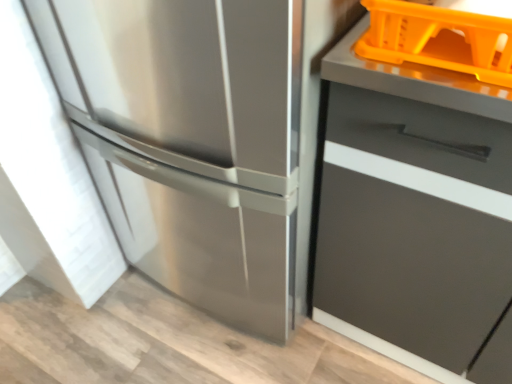
This screenshot has height=384, width=512. What do you see at coordinates (201, 138) in the screenshot?
I see `stainless steel refrigerator at left` at bounding box center [201, 138].

What are the coordinates of `stainless steel refrigerator at left` in the screenshot? It's located at (201, 138).

Measure the distance between point [449,44] and camera.

The distance of point [449,44] from camera is 26.30 inches.

This screenshot has width=512, height=384. What are the coordinates of `orange plastic basket at upper right` in the screenshot? It's located at (438, 39).

The height and width of the screenshot is (384, 512). In order to click on stainless steel refrigerator at left in this screenshot , I will do `click(201, 138)`.

Is stainless steel refrigerator at left located within matte gray drawer at right?

No.

Which of these two, matte gray drawer at right or stainless steel refrigerator at left, is bigger?

With larger size is stainless steel refrigerator at left.

Can you tell me how much matte gray drawer at right and stainless steel refrigerator at left differ in facing direction?

matte gray drawer at right and stainless steel refrigerator at left are facing 1.22 degrees away from each other.

Is the position of matte gray drawer at right more distant than that of stainless steel refrigerator at left?

No.

Considering the positions of objects stainless steel refrigerator at left and matte gray drawer at right in the image provided, who is more to the left, stainless steel refrigerator at left or matte gray drawer at right?

stainless steel refrigerator at left is more to the left.

Where is `cabinetry in front of the stainless steel refrigerator at left`? cabinetry in front of the stainless steel refrigerator at left is located at coordinates (416, 216).

Is stainless steel refrigerator at left in front of or behind matte gray drawer at right in the image?

In the image, stainless steel refrigerator at left appears behind matte gray drawer at right.

Does point (318, 246) appear closer or farther from the camera than point (379, 60)?

Clearly, point (318, 246) is more distant from the camera than point (379, 60).

From the image's perspective, is matte gray drawer at right on orange plastic basket at upper right?

No, from the image's perspective, matte gray drawer at right is not over orange plastic basket at upper right.

Is matte gray drawer at right not within orange plastic basket at upper right?

Absolutely, matte gray drawer at right is external to orange plastic basket at upper right.

Is orange plastic basket at upper right at the right side of matte gray drawer at right?

In fact, orange plastic basket at upper right is to the left of matte gray drawer at right.

From the image's perspective, is orange plastic basket at upper right below matte gray drawer at right?

No, from the image's perspective, orange plastic basket at upper right is not beneath matte gray drawer at right.

Does orange plastic basket at upper right have a greater height compared to matte gray drawer at right?

Incorrect, the height of orange plastic basket at upper right is not larger of that of matte gray drawer at right.

How distant is orange plastic basket at upper right from stainless steel refrigerator at left?

The distance of orange plastic basket at upper right from stainless steel refrigerator at left is 16.42 inches.

Is orange plastic basket at upper right not near stainless steel refrigerator at left?

Actually, orange plastic basket at upper right and stainless steel refrigerator at left are a little close together.

Image resolution: width=512 pixels, height=384 pixels. There is a stainless steel refrigerator at left. Find the location of `basket above it (from a real-world perspective)`. basket above it (from a real-world perspective) is located at coordinates (438, 39).

Is orange plastic basket at upper right to the right of stainless steel refrigerator at left from the viewer's perspective?

Yes, orange plastic basket at upper right is to the right of stainless steel refrigerator at left.

Which point is more distant from viewer, (220, 236) or (429, 61)?

The point (220, 236) is farther from the camera.

Is stainless steel refrigerator at left to the left or to the right of orange plastic basket at upper right in the image?

stainless steel refrigerator at left is positioned on orange plastic basket at upper right's left side.

Identify the location of refrigerator on the left of orange plastic basket at upper right. This screenshot has width=512, height=384. (201, 138).

You are a GUI agent. You are given a task and a screenshot of the screen. Output one action in this format:
    pyautogui.click(x=<x>, y=<y>)
    Task: Click on the cabinetry located in front of the stainless steel refrigerator at left
    
    Given the screenshot: What is the action you would take?
    pyautogui.click(x=416, y=216)

I want to click on refrigerator above the matte gray drawer at right (from the image's perspective), so click(201, 138).

Considering their positions, is matte gray drawer at right positioned further to stainless steel refrigerator at left than orange plastic basket at upper right?

Based on the image, orange plastic basket at upper right appears to be further to stainless steel refrigerator at left.

From the image, which object appears to be nearer to orange plastic basket at upper right, matte gray drawer at right or stainless steel refrigerator at left?

matte gray drawer at right is closer to orange plastic basket at upper right.

Which object lies nearer to the anchor point orange plastic basket at upper right, stainless steel refrigerator at left or matte gray drawer at right?

matte gray drawer at right lies closer to orange plastic basket at upper right than the other object.

When comparing their distances from matte gray drawer at right, does orange plastic basket at upper right or stainless steel refrigerator at left seem closer?

stainless steel refrigerator at left.

Considering their positions, is stainless steel refrigerator at left positioned closer to matte gray drawer at right than orange plastic basket at upper right?

The object closer to matte gray drawer at right is stainless steel refrigerator at left.

When comparing their distances from stainless steel refrigerator at left, does orange plastic basket at upper right or matte gray drawer at right seem closer?

matte gray drawer at right is positioned closer to the anchor stainless steel refrigerator at left.

This screenshot has width=512, height=384. I want to click on basket between stainless steel refrigerator at left and matte gray drawer at right from left to right, so click(438, 39).